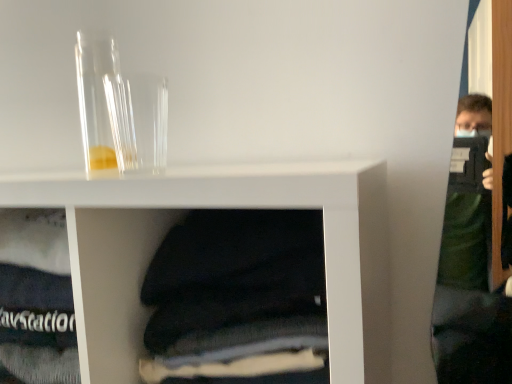
Question: In the image, is transparent glass vase at upper left, positioned as the second glass vase in left-to-right order, on the left side or the right side of transparent glass tube at upper left, positioned as the 2th glass vase in right-to-left order?

Choices:
 (A) left
 (B) right

Answer: (B)

Question: From a real-world perspective, relative to transparent glass tube at upper left, which is counted as the first glass vase, starting from the left, is transparent glass vase at upper left, which is the 1th glass vase from right to left, vertically above or below?

Choices:
 (A) below
 (B) above

Answer: (A)

Question: Looking at their shapes, would you say transparent glass vase at upper left, which is the 1th glass vase from right to left, is wider or thinner than transparent glass tube at upper left, which is counted as the first glass vase, starting from the left?

Choices:
 (A) thin
 (B) wide

Answer: (B)

Question: Is transparent glass tube at upper left, positioned as the 2th glass vase in right-to-left order, in front of or behind transparent glass vase at upper left, which is the 1th glass vase from right to left, in the image?

Choices:
 (A) front
 (B) behind

Answer: (B)

Question: Considering the positions of transparent glass tube at upper left, positioned as the 2th glass vase in right-to-left order, and transparent glass vase at upper left, which is the 1th glass vase from right to left, in the image, is transparent glass tube at upper left, positioned as the 2th glass vase in right-to-left order, taller or shorter than transparent glass vase at upper left, which is the 1th glass vase from right to left,?

Choices:
 (A) short
 (B) tall

Answer: (B)

Question: Is transparent glass tube at upper left, positioned as the 2th glass vase in right-to-left order, bigger or smaller than transparent glass vase at upper left, which is the 1th glass vase from right to left?

Choices:
 (A) big
 (B) small

Answer: (A)

Question: Would you say transparent glass tube at upper left, which is counted as the first glass vase, starting from the left, is to the left or to the right of transparent glass vase at upper left, which is the 1th glass vase from right to left, in the picture?

Choices:
 (A) right
 (B) left

Answer: (B)